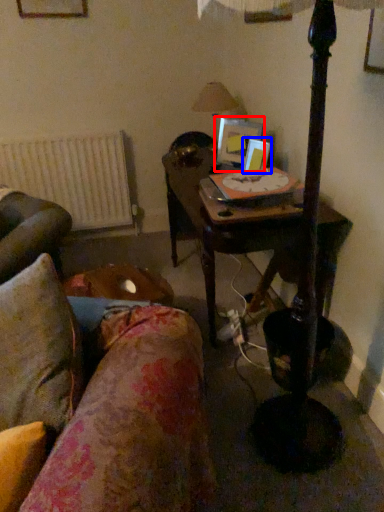
Question: Which point is closer to the camera, picture frame (highlighted by a red box) or picture frame (highlighted by a blue box)?

Choices:
 (A) picture frame
 (B) picture frame

Answer: (B)